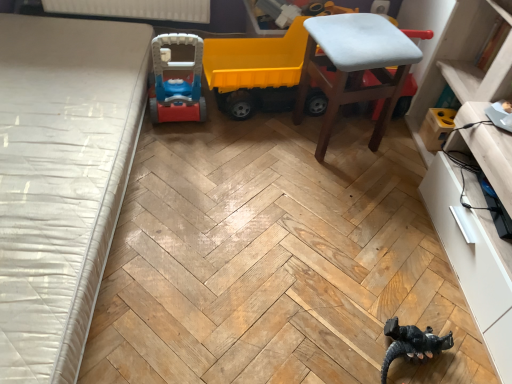
I want to click on vacant space that is to the left of black matte toy dinosaur at lower right, so click(340, 332).